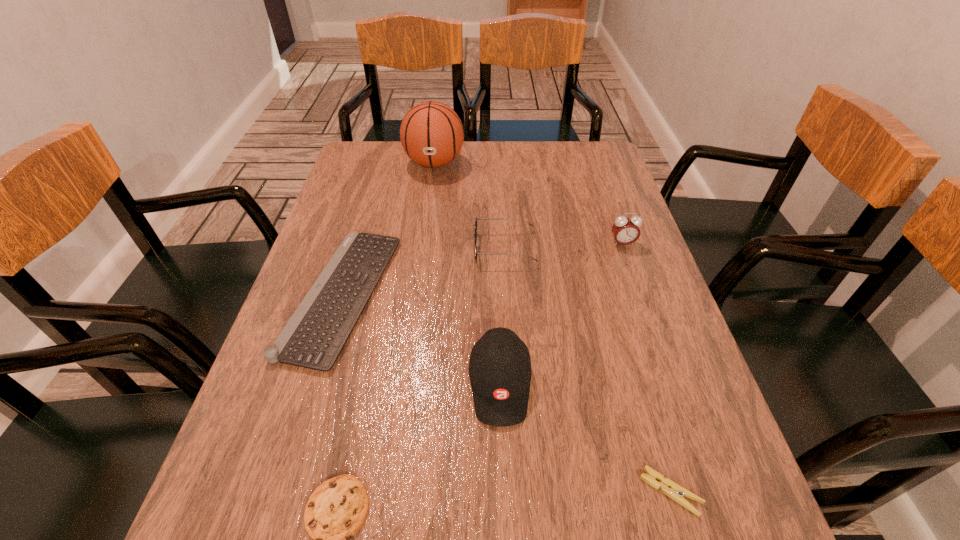
Where is `free space located through the lenses of the spectacles`? The image size is (960, 540). free space located through the lenses of the spectacles is located at coordinates (319, 248).

You are a GUI agent. You are given a task and a screenshot of the screen. Output one action in this format:
    pyautogui.click(x=<x>, y=<y>)
    Task: Click on the vacant space located through the lenses of the spectacles
    This screenshot has height=540, width=960.
    Given the screenshot: What is the action you would take?
    pyautogui.click(x=444, y=248)

Locate an element on the screen. Image resolution: width=960 pixels, height=540 pixels. vacant point located through the lenses of the spectacles is located at coordinates (416, 248).

The height and width of the screenshot is (540, 960). I want to click on free region located on the right of the third shortest object, so click(x=451, y=295).

You are a GUI agent. You are given a task and a screenshot of the screen. Output one action in this format:
    pyautogui.click(x=<x>, y=<y>)
    Task: Click on the vacant point located 0.350m on the back of the clothespin
    
    Given the screenshot: What is the action you would take?
    pyautogui.click(x=617, y=309)

Find the location of a particular element. object that is at the far edge is located at coordinates (x=431, y=133).

This screenshot has width=960, height=540. What are the coordinates of `object present at the left edge` in the screenshot? It's located at (314, 336).

Locate an element on the screen. alarm clock that is at the right edge is located at coordinates click(x=625, y=230).

Locate an element on the screen. clothespin present at the right edge is located at coordinates (673, 490).

In order to click on free space at the far edge of the desktop in this screenshot , I will do `click(494, 149)`.